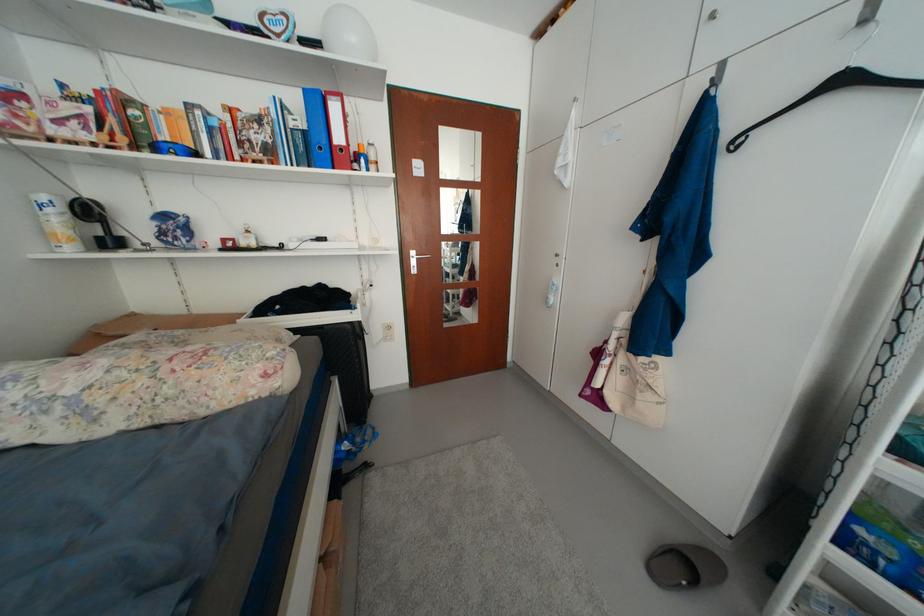
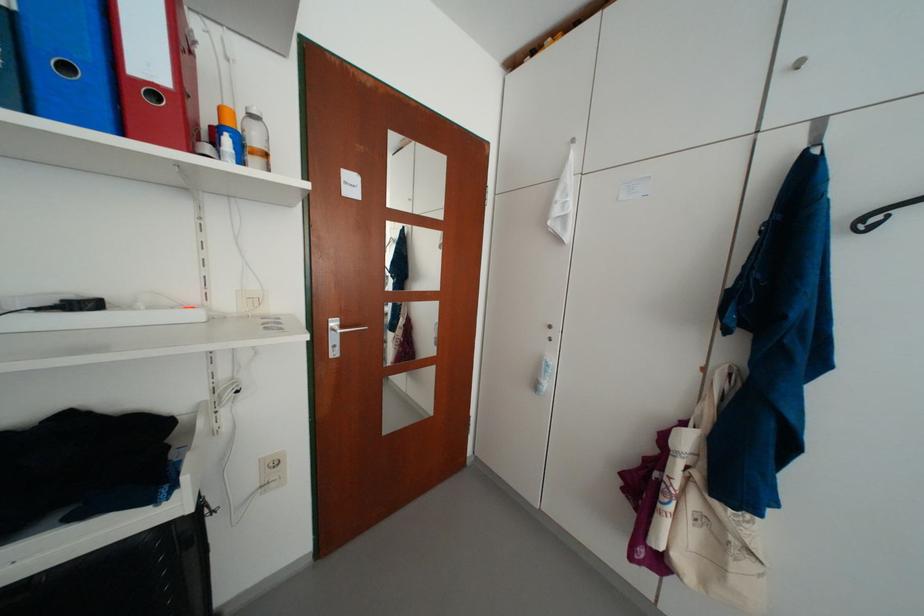
In the second image, find the point that corresponds to pixel 381 169 in the first image.

(263, 163)